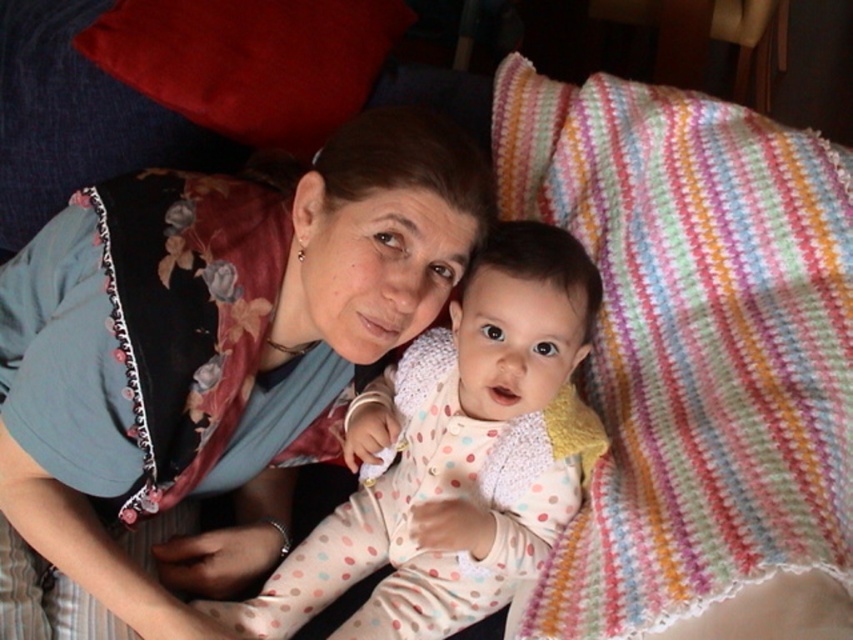
Based on the scene description, where is the multicolored knitted blanket at upper right located in the image?

The multicolored knitted blanket at upper right is located at point (691, 342).

You are an interior designer analyzing the image. You need to place a small decorative item exactly at the coordinates where the matte blue shirt at center is located. What object in the image is at those coordinates?

The matte blue shirt at center is located at point (207, 362), so placing the decorative item there would position it exactly where the matte blue shirt at center is situated.

You are a photographer setting up a shoot in this scene. You want to ensure the polka dot fabric baby at center is visible in the photo without being covered by the multicolored knitted blanket at upper right. Based on the scene description, is this possible?

The multicolored knitted blanket at upper right is positioned over the polka dot fabric baby at center, so it would block the baby from full visibility. To ensure the baby is visible, adjust the blanket to move it away or reposition the baby so the blanket isn